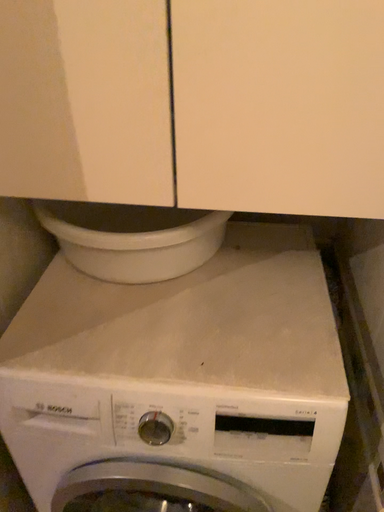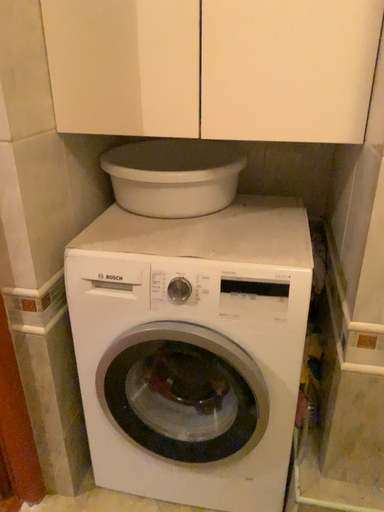
Question: How did the camera likely rotate when shooting the video?

Choices:
 (A) rotated downward
 (B) rotated upward

Answer: (B)